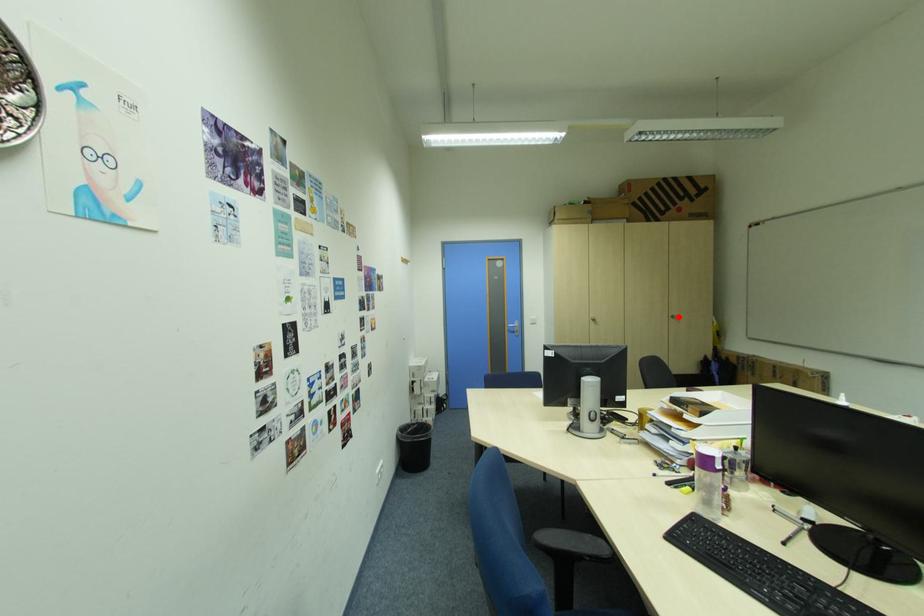
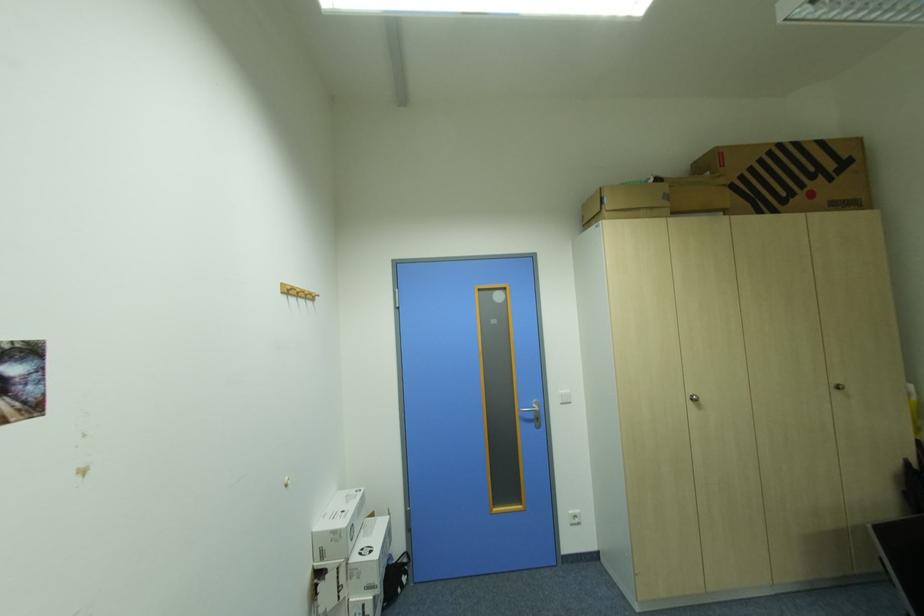
Find the pixel in the second image that matches the highlighted location in the first image.

(840, 386)